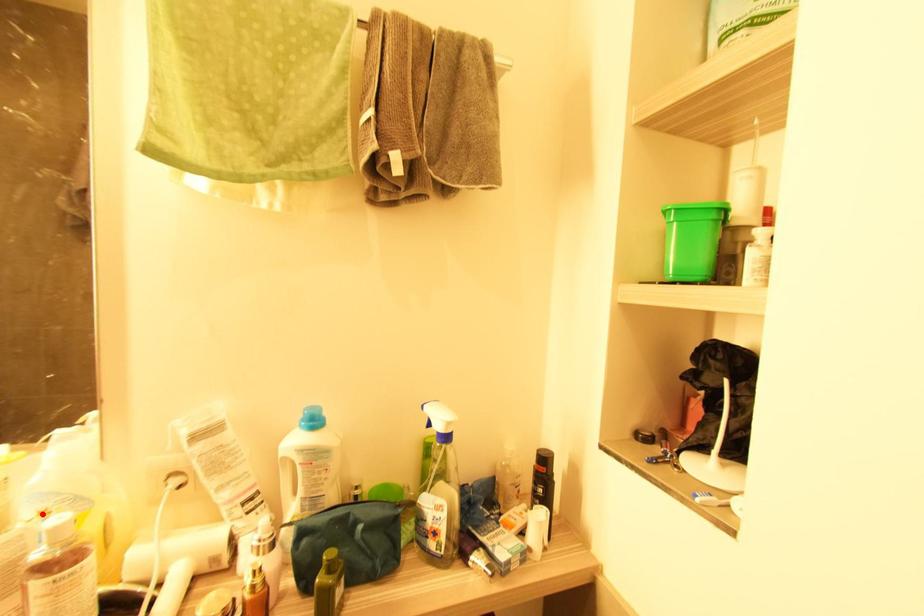
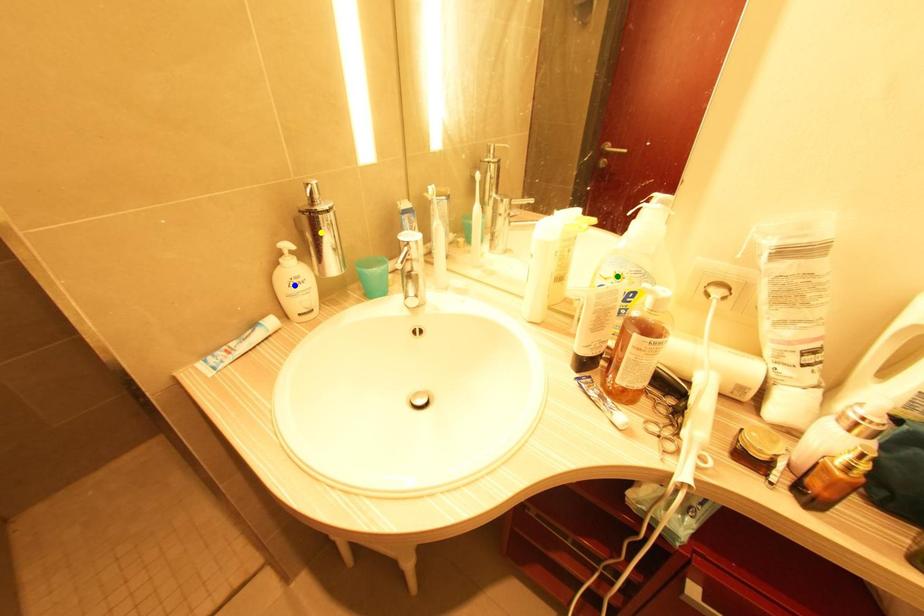
Question: I am providing you with two images of the same scene from different viewpoints. A red point is marked on the first image. You are given multiple points on the second image. In image 2, which mark is for the same physical point as the one in image 1?

Choices:
 (A) green point
 (B) blue point
 (C) yellow point

Answer: (A)